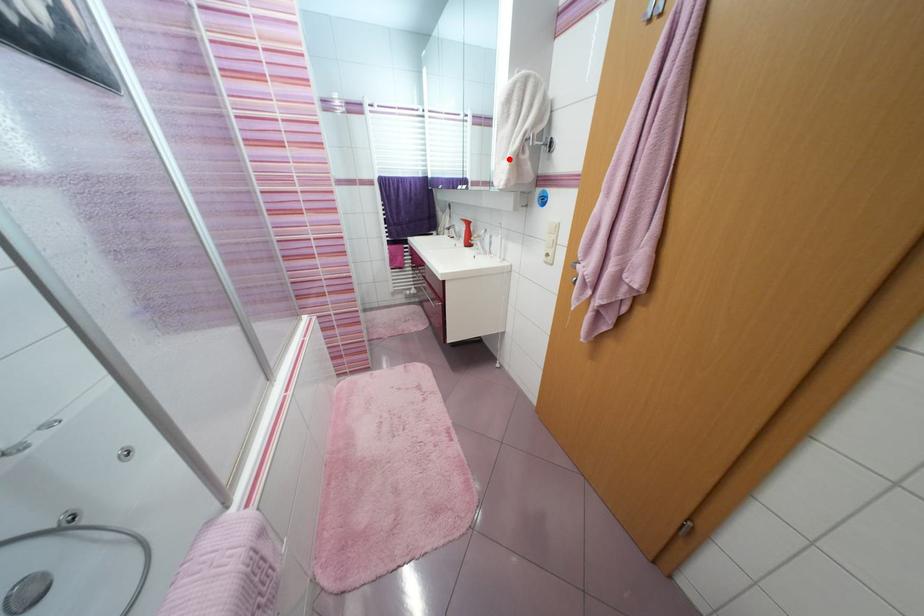
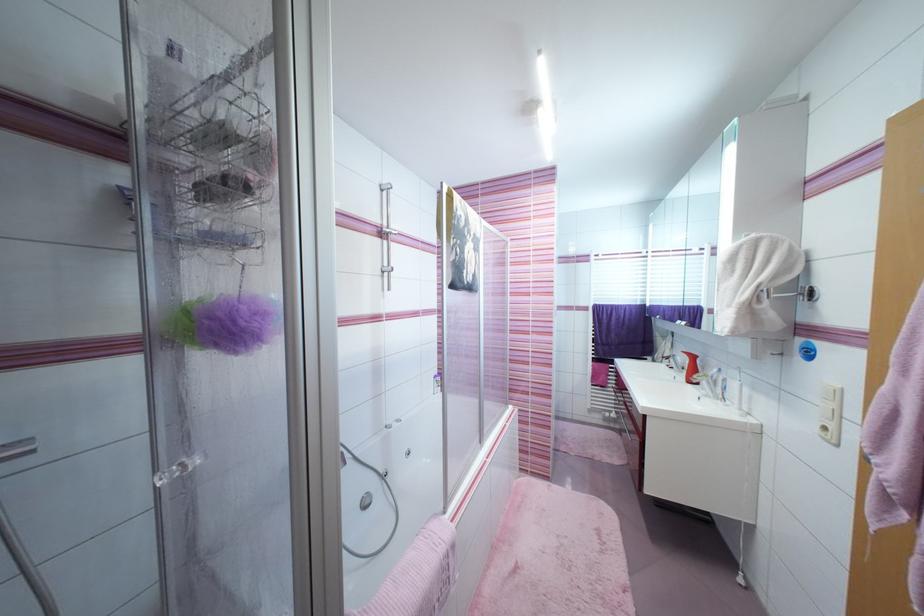
Locate, in the second image, the point that corresponds to the highlighted location in the first image.

(735, 307)